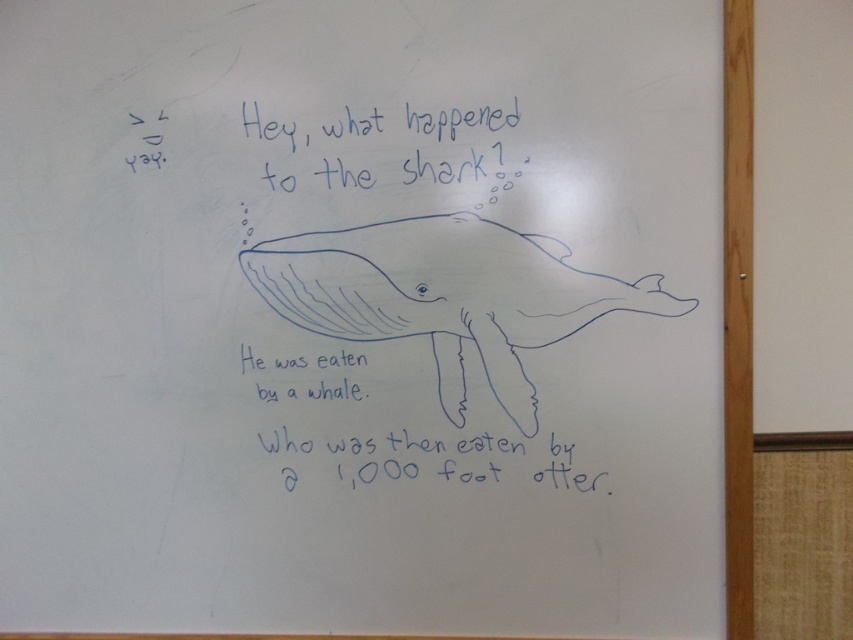
You are an artist holding a 1 meter wide canvas. You want to paint the blue line drawing whale at center and the blue handwritten text at upper center from the image onto your canvas. Can both fit side by side horizontally without overlapping?

The blue line drawing whale at center might be wider than blue handwritten text at upper center. Since the total width of both objects could exceed 1 meter, it is uncertain if they can fit side by side horizontally without overlapping.